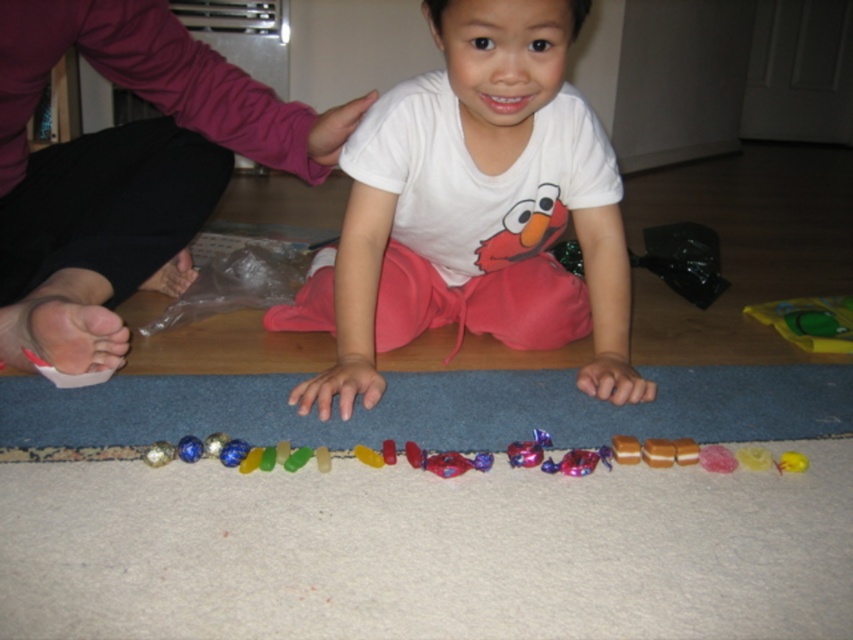
You are a photographer standing at the camera position. You want to take a clear photo of the white cotton toddler at center. What is the minimum distance you need to maintain to ensure the toddler is in focus?

The minimum distance you need to maintain is 3.48 feet because the white cotton toddler at center and camera are 3.48 feet apart.

Consider the image. You are a parent trying to teach your child about spatial relationships. You point to the glossy plastic candy at center and the translucent yellow candy at center. Which candy is closer to the child?

The glossy plastic candy at center is closer to the child because it is positioned in front of the translucent yellow candy at center.